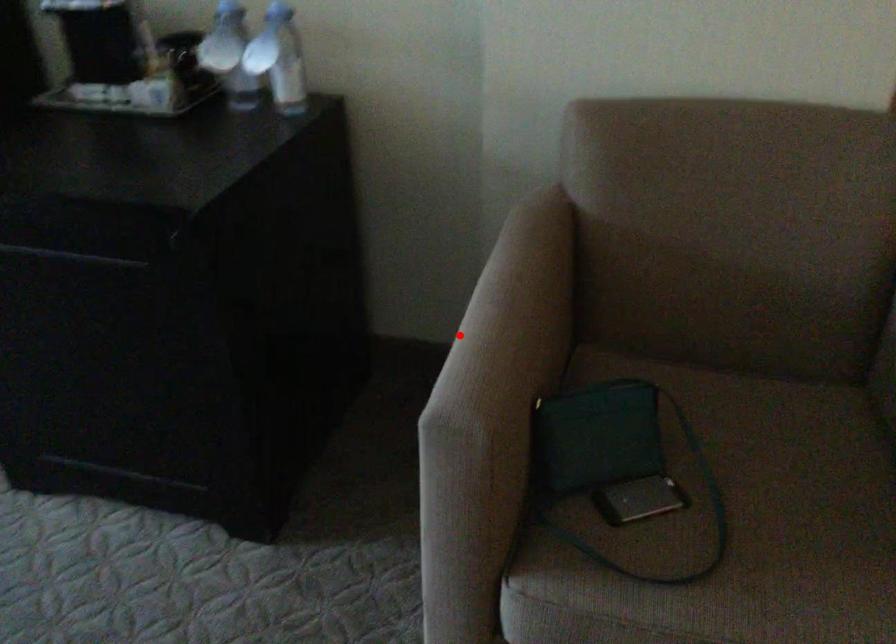
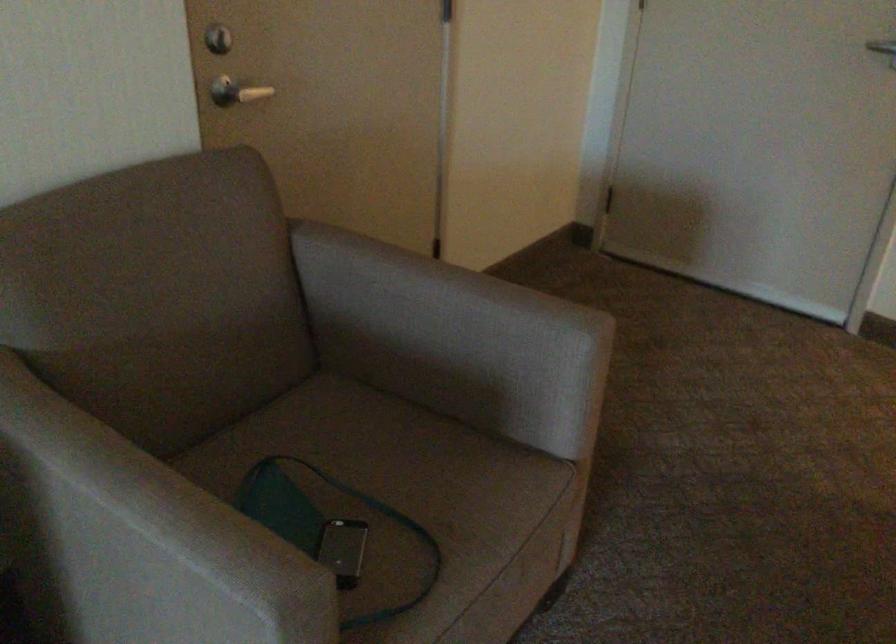
Question: I am providing you with two images of the same scene from different viewpoints. Given a red point in image1, look at the same physical point in image2. Is it:

Choices:
 (A) Closer to the viewpoint
 (B) Farther from the viewpoint

Answer: (A)